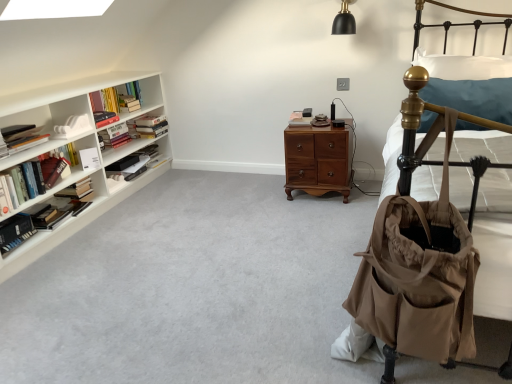
Question: Is white soft pillow at upper right placed right next to brown wood nightstand at center?

Choices:
 (A) no
 (B) yes

Answer: (A)

Question: Is white soft pillow at upper right surrounding brown wood nightstand at center?

Choices:
 (A) yes
 (B) no

Answer: (B)

Question: Considering the relative sizes of white soft pillow at upper right and brown wood nightstand at center in the image provided, is white soft pillow at upper right thinner than brown wood nightstand at center?

Choices:
 (A) yes
 (B) no

Answer: (A)

Question: From a real-world perspective, is white soft pillow at upper right physically above brown wood nightstand at center?

Choices:
 (A) no
 (B) yes

Answer: (B)

Question: From the image's perspective, does white soft pillow at upper right appear higher than brown wood nightstand at center?

Choices:
 (A) yes
 (B) no

Answer: (A)

Question: Is white soft pillow at upper right not within brown wood nightstand at center?

Choices:
 (A) yes
 (B) no

Answer: (A)

Question: Is hardcover book at left, the 3th book from the left, at the right side of hardcover book at left, which ranks as the 4th book in right-to-left order?

Choices:
 (A) yes
 (B) no

Answer: (B)

Question: Does hardcover book at left, the 3th book from the left, have a greater width compared to hardcover book at left, which ranks as the 4th book in right-to-left order?

Choices:
 (A) yes
 (B) no

Answer: (B)

Question: Considering the relative positions of hardcover book at left, which is the 8th book in right-to-left order, and hardcover book at left, the 7th book positioned from the left, in the image provided, is hardcover book at left, which is the 8th book in right-to-left order, to the left of hardcover book at left, the 7th book positioned from the left, from the viewer's perspective?

Choices:
 (A) yes
 (B) no

Answer: (A)

Question: Is hardcover book at left, the 3th book from the left, closer to camera compared to hardcover book at left, which ranks as the 4th book in right-to-left order?

Choices:
 (A) yes
 (B) no

Answer: (A)

Question: Is hardcover book at left, which is the 8th book in right-to-left order, directly adjacent to hardcover book at left, the 7th book positioned from the left?

Choices:
 (A) yes
 (B) no

Answer: (B)

Question: From the image's perspective, is hardcover book at left, the 3th book from the left, on hardcover book at left, the 7th book positioned from the left?

Choices:
 (A) no
 (B) yes

Answer: (A)

Question: Considering the relative sizes of white soft pillow at upper right and white matte book at center, which ranks as the tenth book in left-to-right order, in the image provided, is white soft pillow at upper right taller than white matte book at center, which ranks as the tenth book in left-to-right order,?

Choices:
 (A) yes
 (B) no

Answer: (A)